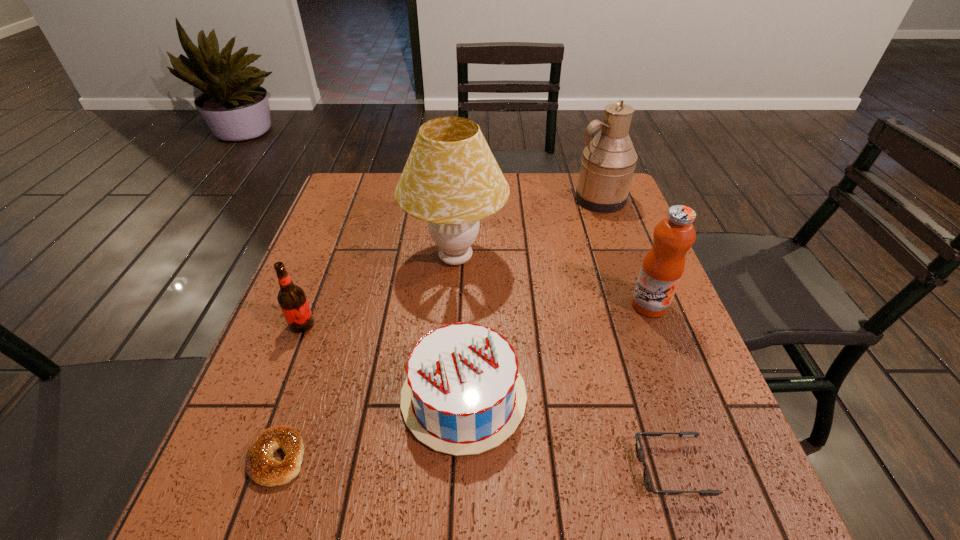
Point out which object is positioned as the nearest to the fourth tallest object. Please provide its 2D coordinates. Your answer should be formatted as a tuple, i.e. [(x, y)], where the tuple contains the x and y coordinates of a point satisfying the conditions above.

[(451, 180)]

This screenshot has height=540, width=960. Find the location of `object identified as the fourth closest to the sunglasses`. object identified as the fourth closest to the sunglasses is located at coordinates (261, 466).

What are the coordinates of `free space that satisfies the following two spatial constraints: 1. on the front label of the fruit juice; 2. on the temples of the sunglasses` in the screenshot? It's located at (712, 469).

Where is `vacant space that satisfies the following two spatial constraints: 1. on the front label of the fruit juice; 2. on the temples of the sunglasses`? The image size is (960, 540). vacant space that satisfies the following two spatial constraints: 1. on the front label of the fruit juice; 2. on the temples of the sunglasses is located at coordinates (712, 469).